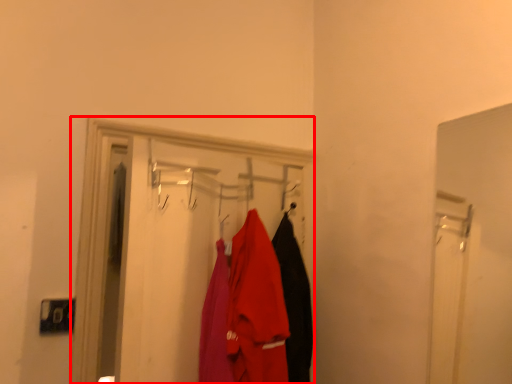
Question: From the image's perspective, what is the correct spatial positioning of closet (annotated by the red box) in reference to clothing?

Choices:
 (A) above
 (B) below

Answer: (A)